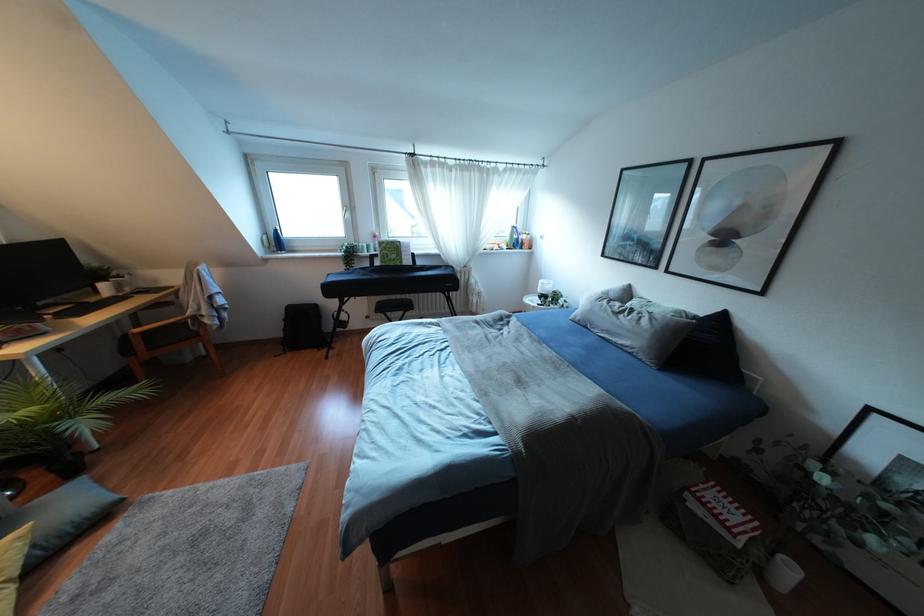
Where would you grasp the wooden chair armrest? Please return your answer as a coordinate pair (x, y).

(163, 334)